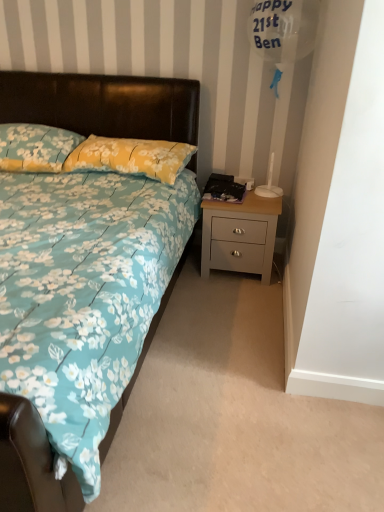
The width and height of the screenshot is (384, 512). What are the coordinates of `floral fabric pillow at upper left, the 2th pillow positioned from the right` in the screenshot? It's located at (35, 147).

This screenshot has height=512, width=384. Describe the element at coordinates (103, 104) in the screenshot. I see `floral fabric bed at center` at that location.

Find the location of `floral fabric bed at center`. floral fabric bed at center is located at coordinates (103, 104).

You are a GUI agent. You are given a task and a screenshot of the screen. Output one action in this format:
    pyautogui.click(x=<x>, y=<y>)
    Task: Click on the floral fabric pillow at upper left, the 2th pillow positioned from the right
    
    Given the screenshot: What is the action you would take?
    pyautogui.click(x=35, y=147)

Is floral fabric pillow at upper left, the 2th pillow positioned from the right, wider or thinner than yellow floral fabric pillow at center, the first pillow viewed from the right?

In the image, floral fabric pillow at upper left, the 2th pillow positioned from the right, appears to be wider than yellow floral fabric pillow at center, the first pillow viewed from the right.

Which is closer, (54,141) or (141,164)?

Point (54,141) is positioned farther from the camera compared to point (141,164).

Which of these two, floral fabric pillow at upper left, the 2th pillow positioned from the right, or yellow floral fabric pillow at center, marked as the 2th pillow in a left-to-right arrangement, is bigger?

With larger size is floral fabric pillow at upper left, the 2th pillow positioned from the right.

How different are the orientations of light gray wood nightstand at lower right and yellow floral fabric pillow at center, marked as the 2th pillow in a left-to-right arrangement, in degrees?

light gray wood nightstand at lower right and yellow floral fabric pillow at center, marked as the 2th pillow in a left-to-right arrangement, are facing 1.37 degrees away from each other.

Between light gray wood nightstand at lower right and yellow floral fabric pillow at center, marked as the 2th pillow in a left-to-right arrangement, which one has larger size?

light gray wood nightstand at lower right.

From the image's perspective, count 1st pillows upward from the light gray wood nightstand at lower right and point to it. Please provide its 2D coordinates.

[(131, 157)]

Based on the photo, is light gray wood nightstand at lower right not inside yellow floral fabric pillow at center, marked as the 2th pillow in a left-to-right arrangement?

Yes, light gray wood nightstand at lower right is located beyond the bounds of yellow floral fabric pillow at center, marked as the 2th pillow in a left-to-right arrangement.

Can you confirm if floral fabric pillow at upper left, arranged as the first pillow when viewed from the left, is wider than light gray wood nightstand at lower right?

Yes, floral fabric pillow at upper left, arranged as the first pillow when viewed from the left, is wider than light gray wood nightstand at lower right.

Which object is closer to the camera, floral fabric pillow at upper left, the 2th pillow positioned from the right, or light gray wood nightstand at lower right?

floral fabric pillow at upper left, the 2th pillow positioned from the right, is more forward.

Is light gray wood nightstand at lower right at the back of floral fabric pillow at upper left, arranged as the first pillow when viewed from the left?

No, floral fabric pillow at upper left, arranged as the first pillow when viewed from the left, is not facing away from light gray wood nightstand at lower right.

From a real-world perspective, which object stands above the other?

floral fabric pillow at upper left, arranged as the first pillow when viewed from the left.

Are light gray wood nightstand at lower right and floral fabric pillow at upper left, the 2th pillow positioned from the right, located far from each other?

Absolutely, light gray wood nightstand at lower right is distant from floral fabric pillow at upper left, the 2th pillow positioned from the right.

Is light gray wood nightstand at lower right oriented away from floral fabric pillow at upper left, the 2th pillow positioned from the right?

No, light gray wood nightstand at lower right is not facing the opposite direction of floral fabric pillow at upper left, the 2th pillow positioned from the right.

From a real-world perspective, between light gray wood nightstand at lower right and floral fabric pillow at upper left, the 2th pillow positioned from the right, who is vertically lower?

From a 3D spatial view, light gray wood nightstand at lower right is below.

Can you confirm if light gray wood nightstand at lower right is thinner than floral fabric pillow at upper left, arranged as the first pillow when viewed from the left?

Yes.

Which object is closer to the camera, yellow floral fabric pillow at center, marked as the 2th pillow in a left-to-right arrangement, or floral fabric bed at center?

floral fabric bed at center is in front.

This screenshot has width=384, height=512. What are the coordinates of `bed below the yellow floral fabric pillow at center, marked as the 2th pillow in a left-to-right arrangement (from the image's perspective)` in the screenshot? It's located at (103, 104).

Consider the image. From a real-world perspective, is yellow floral fabric pillow at center, the first pillow viewed from the right, over floral fabric bed at center?

Yes.

Considering the relative positions of yellow floral fabric pillow at center, marked as the 2th pillow in a left-to-right arrangement, and floral fabric bed at center in the image provided, is yellow floral fabric pillow at center, marked as the 2th pillow in a left-to-right arrangement, to the right of floral fabric bed at center from the viewer's perspective?

Correct, you'll find yellow floral fabric pillow at center, marked as the 2th pillow in a left-to-right arrangement, to the right of floral fabric bed at center.

Can you confirm if floral fabric bed at center is bigger than yellow floral fabric pillow at center, the first pillow viewed from the right?

Correct, floral fabric bed at center is larger in size than yellow floral fabric pillow at center, the first pillow viewed from the right.

Which object is positioned more to the right, floral fabric bed at center or yellow floral fabric pillow at center, marked as the 2th pillow in a left-to-right arrangement?

From the viewer's perspective, yellow floral fabric pillow at center, marked as the 2th pillow in a left-to-right arrangement, appears more on the right side.

Between floral fabric bed at center and floral fabric pillow at upper left, arranged as the first pillow when viewed from the left, which one appears on the left side from the viewer's perspective?

floral fabric pillow at upper left, arranged as the first pillow when viewed from the left.

Is floral fabric bed at center wider than floral fabric pillow at upper left, arranged as the first pillow when viewed from the left?

Correct, the width of floral fabric bed at center exceeds that of floral fabric pillow at upper left, arranged as the first pillow when viewed from the left.

How distant is floral fabric bed at center from floral fabric pillow at upper left, the 2th pillow positioned from the right?

floral fabric bed at center is 13.33 inches away from floral fabric pillow at upper left, the 2th pillow positioned from the right.

Locate an element on the screen. The image size is (384, 512). pillow on the right of floral fabric pillow at upper left, arranged as the first pillow when viewed from the left is located at coordinates (131, 157).

From the light gray wood nightstand at lower right, count 2nd pillows forward and point to it. Please provide its 2D coordinates.

[(131, 157)]

Looking at the image, which one is located further to floral fabric pillow at upper left, the 2th pillow positioned from the right, light gray wood nightstand at lower right or yellow floral fabric pillow at center, the first pillow viewed from the right?

light gray wood nightstand at lower right is further to floral fabric pillow at upper left, the 2th pillow positioned from the right.

Considering their positions, is floral fabric pillow at upper left, arranged as the first pillow when viewed from the left, positioned further to yellow floral fabric pillow at center, marked as the 2th pillow in a left-to-right arrangement, than light gray wood nightstand at lower right?

light gray wood nightstand at lower right lies further to yellow floral fabric pillow at center, marked as the 2th pillow in a left-to-right arrangement, than the other object.

When comparing their distances from floral fabric bed at center, does light gray wood nightstand at lower right or floral fabric pillow at upper left, the 2th pillow positioned from the right, seem further?

The object further to floral fabric bed at center is light gray wood nightstand at lower right.

Estimate the real-world distances between objects in this image. Which object is closer to light gray wood nightstand at lower right, yellow floral fabric pillow at center, marked as the 2th pillow in a left-to-right arrangement, or floral fabric pillow at upper left, arranged as the first pillow when viewed from the left?

yellow floral fabric pillow at center, marked as the 2th pillow in a left-to-right arrangement, is closer to light gray wood nightstand at lower right.

Looking at the image, which one is located further to light gray wood nightstand at lower right, yellow floral fabric pillow at center, the first pillow viewed from the right, or floral fabric bed at center?

floral fabric bed at center.

When comparing their distances from yellow floral fabric pillow at center, marked as the 2th pillow in a left-to-right arrangement, does floral fabric bed at center or floral fabric pillow at upper left, the 2th pillow positioned from the right, seem closer?

floral fabric pillow at upper left, the 2th pillow positioned from the right, is positioned closer to the anchor yellow floral fabric pillow at center, marked as the 2th pillow in a left-to-right arrangement.

Based on their spatial positions, is light gray wood nightstand at lower right or floral fabric bed at center closer to floral fabric pillow at upper left, the 2th pillow positioned from the right?

Based on the image, floral fabric bed at center appears to be nearer to floral fabric pillow at upper left, the 2th pillow positioned from the right.

From the image, which object appears to be farther from light gray wood nightstand at lower right, floral fabric pillow at upper left, arranged as the first pillow when viewed from the left, or floral fabric bed at center?

floral fabric pillow at upper left, arranged as the first pillow when viewed from the left.

The height and width of the screenshot is (512, 384). In order to click on pillow between floral fabric pillow at upper left, the 2th pillow positioned from the right, and light gray wood nightstand at lower right from left to right in this screenshot , I will do `click(131, 157)`.

Where is `pillow between floral fabric bed at center and floral fabric pillow at upper left, the 2th pillow positioned from the right, along the z-axis`? The image size is (384, 512). pillow between floral fabric bed at center and floral fabric pillow at upper left, the 2th pillow positioned from the right, along the z-axis is located at coordinates (131, 157).